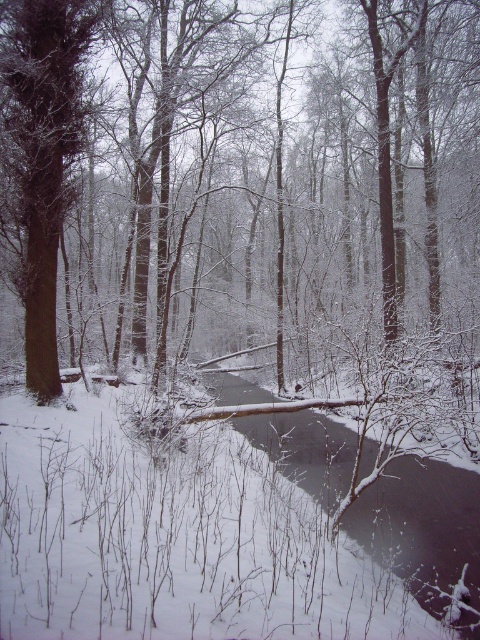
Question: Is the position of brown smooth tree at center more distant than that of brown rough tree at left?

Choices:
 (A) yes
 (B) no

Answer: (B)

Question: Does brown smooth tree at center appear over brown rough tree at left?

Choices:
 (A) no
 (B) yes

Answer: (A)

Question: Can you confirm if brown smooth tree at center is bigger than brown rough tree at left?

Choices:
 (A) yes
 (B) no

Answer: (A)

Question: Which point is closer to the camera?

Choices:
 (A) (49, 314)
 (B) (434, 19)

Answer: (A)